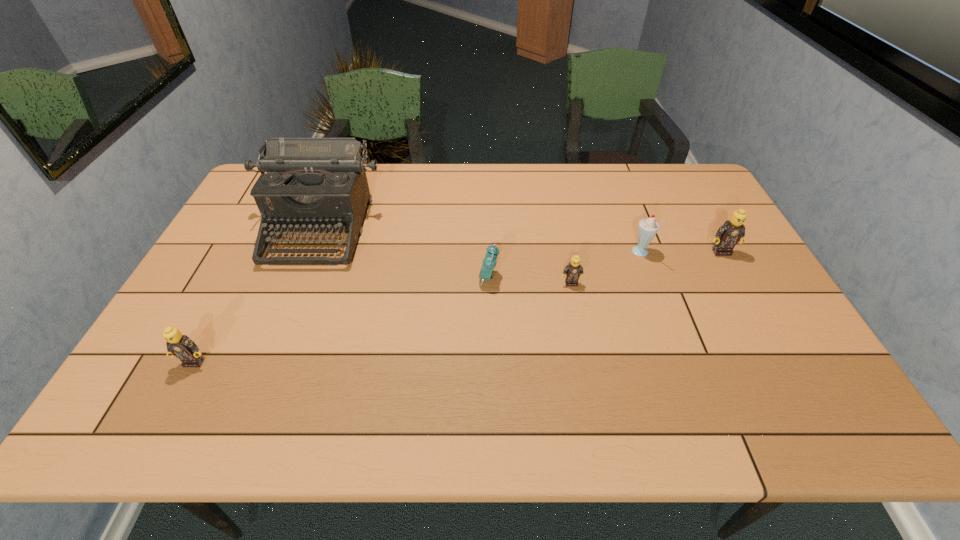
Locate an element on the screen. This screenshot has height=540, width=960. Lego that is at the left edge is located at coordinates (181, 346).

This screenshot has width=960, height=540. What are the coordinates of `typewriter that is at the left edge` in the screenshot? It's located at (313, 184).

The width and height of the screenshot is (960, 540). What are the coordinates of `object located at the right edge` in the screenshot? It's located at (732, 231).

I want to click on object situated at the far left corner, so click(313, 184).

This screenshot has width=960, height=540. Find the location of `object that is at the near left corner`. object that is at the near left corner is located at coordinates (181, 346).

Find the location of a particular element. The height and width of the screenshot is (540, 960). vacant space at the far edge is located at coordinates (560, 197).

Where is `vacant space at the near edge of the desktop`? This screenshot has width=960, height=540. vacant space at the near edge of the desktop is located at coordinates (285, 366).

In the image, there is a desktop. Where is `vacant space at the left edge`? The width and height of the screenshot is (960, 540). vacant space at the left edge is located at coordinates (199, 295).

At what (x,y) coordinates should I click in order to perform the action: click on vacant space at the right edge of the desktop. Please return your answer as a coordinate pair (x, y). This screenshot has width=960, height=540. Looking at the image, I should click on (768, 289).

You are a GUI agent. You are given a task and a screenshot of the screen. Output one action in this format:
    pyautogui.click(x=<x>, y=<y>)
    Task: Click on the unoccupied area between the second shortest Lego and the alarm clock
    Image resolution: width=960 pixels, height=540 pixels.
    Given the screenshot: What is the action you would take?
    pyautogui.click(x=342, y=320)